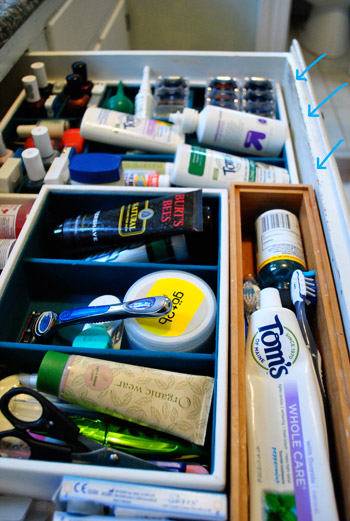
Locate an element on the screen. This screenshot has height=521, width=350. drawers is located at coordinates (331, 196), (77, 28).